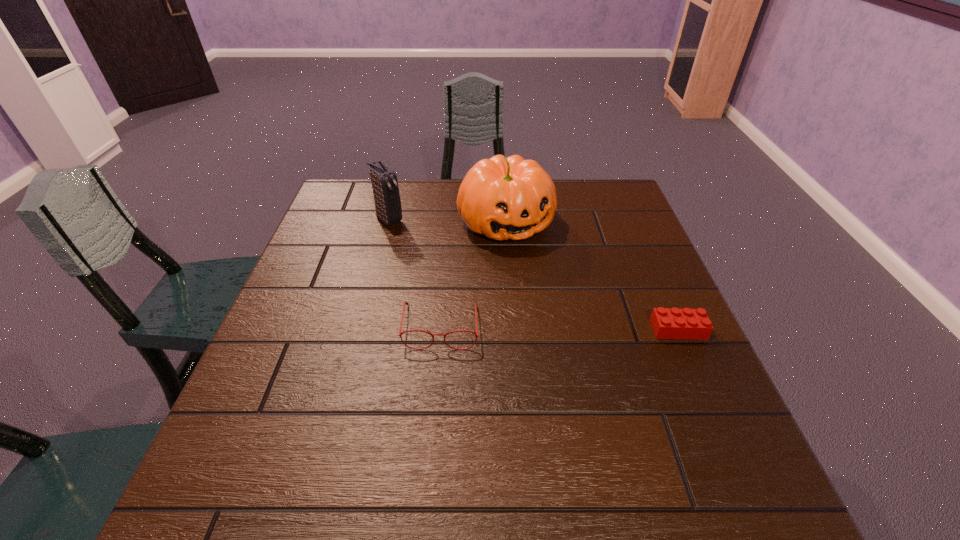
Where is `vacant spot on the desktop that is between the third tallest object and the shortest object and is positioned with the zip open on the leftmost object`? This screenshot has height=540, width=960. vacant spot on the desktop that is between the third tallest object and the shortest object and is positioned with the zip open on the leftmost object is located at coordinates (527, 327).

Locate an element on the screen. Image resolution: width=960 pixels, height=540 pixels. vacant space on the desktop that is between the spectacles and the Lego and is positioned on the carved face of the pumpkin is located at coordinates (579, 328).